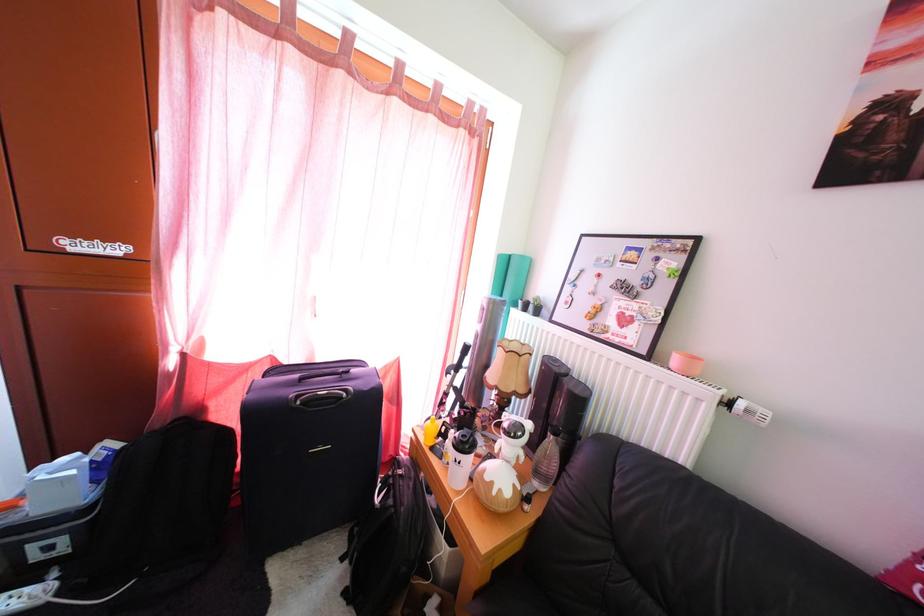
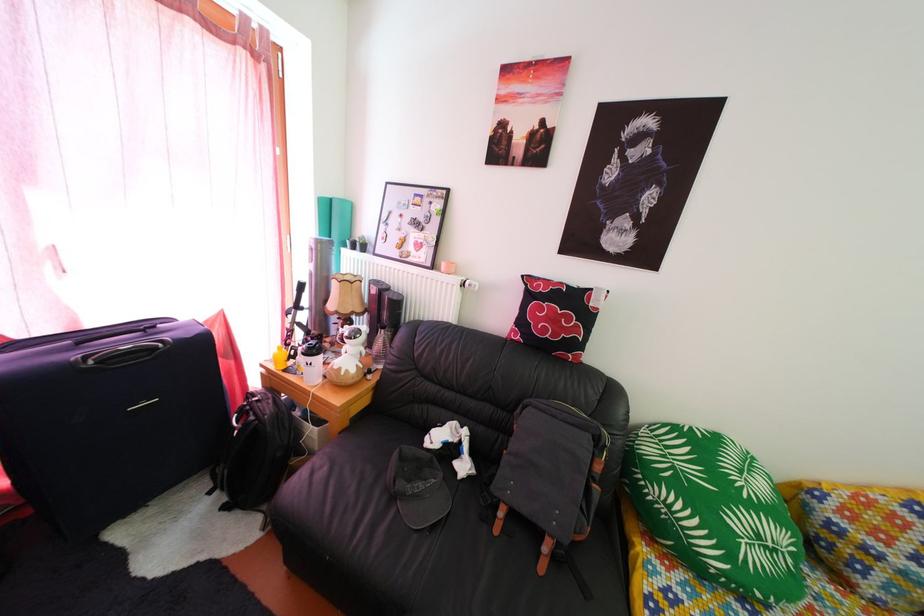
Locate, in the second image, the point that corresponds to (531,466) in the first image.

(372, 361)